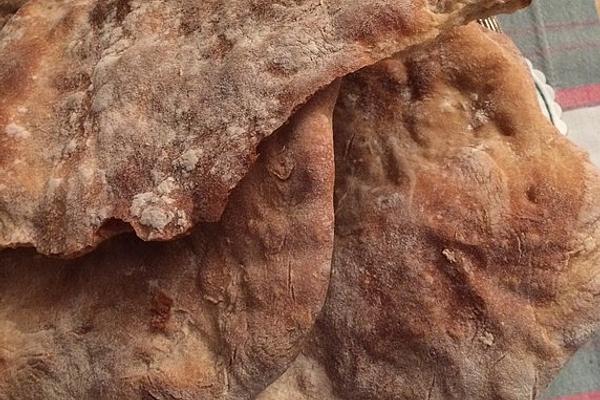
Where is `scalloped edge of plate`? The image size is (600, 400). scalloped edge of plate is located at coordinates (530, 62), (540, 75), (549, 91), (557, 108), (565, 128).